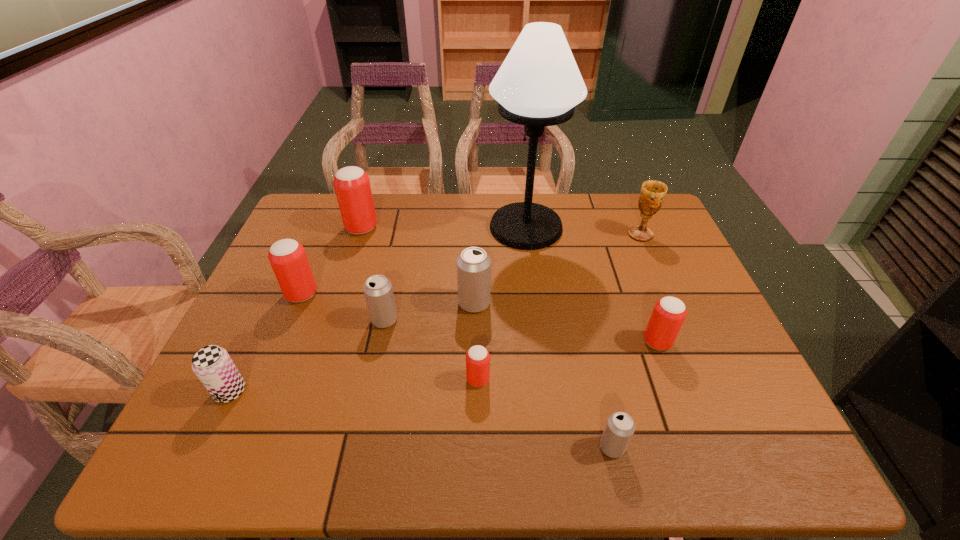
At what (x,y) coordinates should I click in order to perform the action: click on black table lamp. Please return your answer as a coordinate pair (x, y). This screenshot has width=960, height=540. Looking at the image, I should click on (539, 84).

Find the location of a particular element. The image size is (960, 540). the tallest object is located at coordinates (539, 84).

Identify the location of the farthest red beer can. The width and height of the screenshot is (960, 540). (352, 186).

Identify the location of the biggest red beer can. This screenshot has height=540, width=960. (352, 186).

Where is `the rightmost object`? Image resolution: width=960 pixels, height=540 pixels. the rightmost object is located at coordinates (652, 194).

Where is `the second biggest red beer can`? This screenshot has width=960, height=540. the second biggest red beer can is located at coordinates (288, 259).

Locate an element on the screen. the third nearest red beer can is located at coordinates (288, 259).

In order to click on the second white beer can from right to left in this screenshot , I will do `click(473, 265)`.

You are a GUI agent. You are given a task and a screenshot of the screen. Output one action in this format:
    pyautogui.click(x=<x>, y=<y>)
    Task: Click on the second smallest red beer can
    
    Given the screenshot: What is the action you would take?
    [x=669, y=313]

The height and width of the screenshot is (540, 960). Find the location of `the fourth nearest beer can`. the fourth nearest beer can is located at coordinates (669, 313).